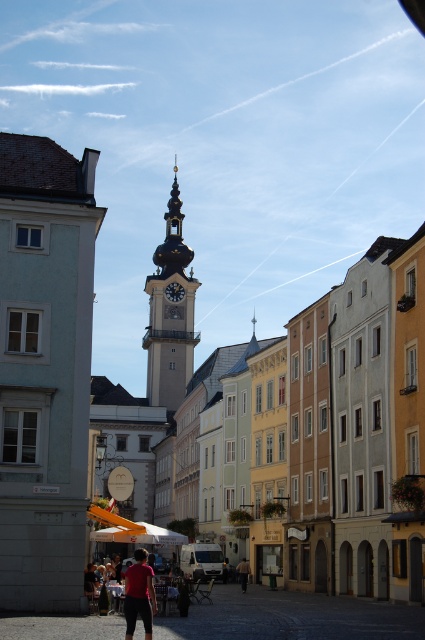
You are a photographer trying to capture a person wearing both a matte black pants at center and a light brown leather jacket at center in the European town square. If you want to ensure both items are clearly visible in your photo, which item should you focus on more due to its size?

The matte black pants at center is bigger than the light brown leather jacket at center, so you should focus on the matte black pants at center to ensure both items are clearly visible.

You are standing at the edge of the European town square and want to find the matte black pants at center. According to the coordinates provided, where should you look to locate them?

The matte black pants at center can be found at coordinates point 0.930 on the x axis and 0.327 on the y axis.

You are standing at the base of the clock tower in the town square and notice two points marked on the ground. The first point is at coordinates point (138, 570) and the second is at point (175, 284). Which point is closer to you?

Answer: Point (138, 570) is in front of point (175, 284), so it is closer to you.